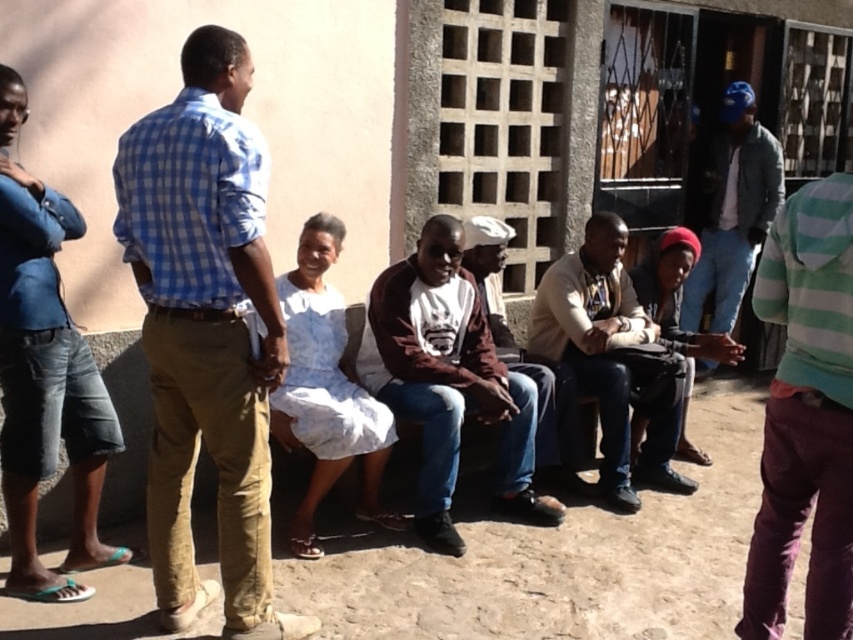
Question: In this image, where is blue checkered shirt at center located relative to blue denim jacket at upper right?

Choices:
 (A) above
 (B) below

Answer: (B)

Question: Which object is positioned farthest from the maroon fabric shirt at center?

Choices:
 (A) maroon fleece jacket at center
 (B) blue denim jacket at upper right
 (C) leather drum at lower right
 (D) blue checkered shirt at center

Answer: (B)

Question: Which of the following is the farthest from the observer?

Choices:
 (A) (503, 332)
 (B) (260, 268)
 (C) (584, 241)
 (D) (444, 365)

Answer: (C)

Question: Is maroon fleece jacket at center in front of light brown leather jacket at center?

Choices:
 (A) yes
 (B) no

Answer: (A)

Question: Considering the relative positions of blue denim jacket at upper right and maroon fabric shirt at center in the image provided, where is blue denim jacket at upper right located with respect to maroon fabric shirt at center?

Choices:
 (A) left
 (B) right

Answer: (B)

Question: Which of the following is the closest to the observer?

Choices:
 (A) leather drum at lower right
 (B) maroon fabric shirt at center
 (C) blue denim jacket at upper right
 (D) blue checkered shirt at center

Answer: (D)